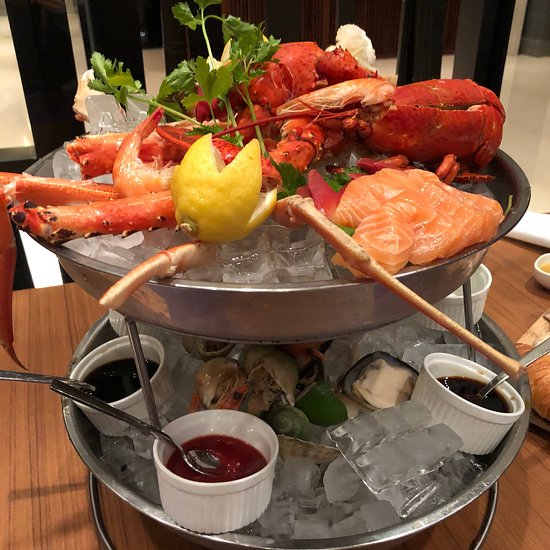
Image resolution: width=550 pixels, height=550 pixels. I want to click on table, so click(x=43, y=470).